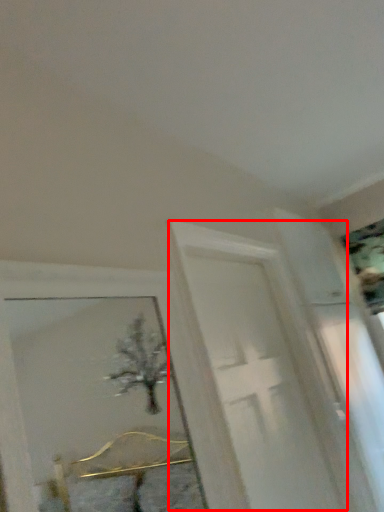
Question: In this image, where is screen door (annotated by the red box) located relative to picture frame?

Choices:
 (A) left
 (B) right

Answer: (A)